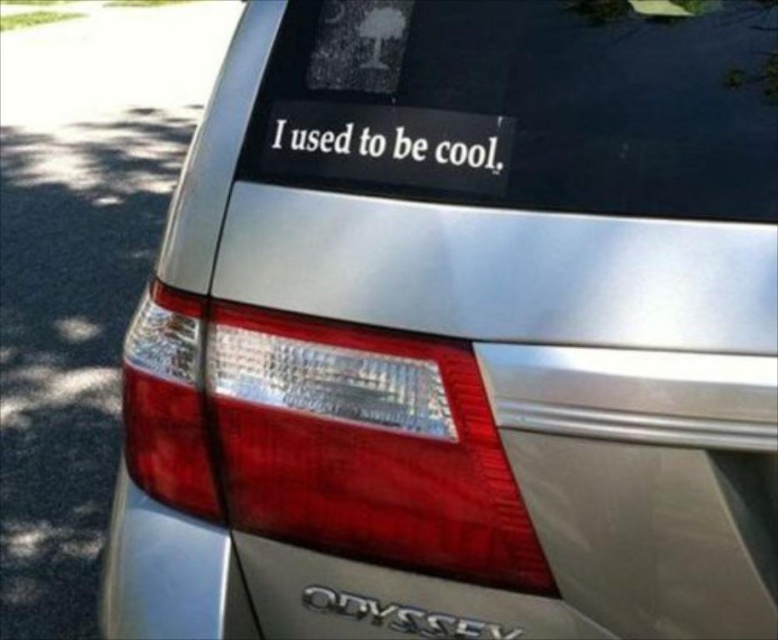
Question: Does white matte sticker at center have a smaller size compared to black metallic odyssey at lower center?

Choices:
 (A) yes
 (B) no

Answer: (B)

Question: Does white matte sticker at center have a larger size compared to black metallic odyssey at lower center?

Choices:
 (A) yes
 (B) no

Answer: (A)

Question: Which point is farther to the camera?

Choices:
 (A) white matte sticker at center
 (B) black metallic odyssey at lower center

Answer: (B)

Question: Can you confirm if white matte sticker at center is smaller than black metallic odyssey at lower center?

Choices:
 (A) yes
 (B) no

Answer: (B)